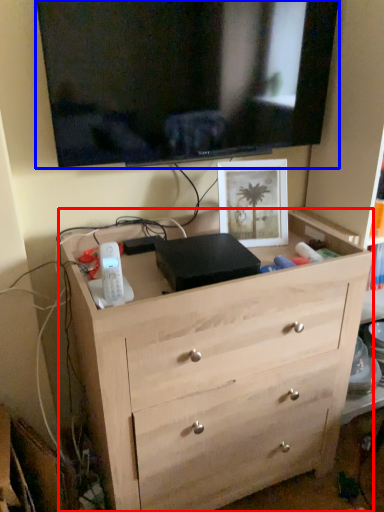
Question: Which of the following is the closest to the observer, chest of drawers (highlighted by a red box) or television (highlighted by a blue box)?

Choices:
 (A) chest of drawers
 (B) television

Answer: (A)